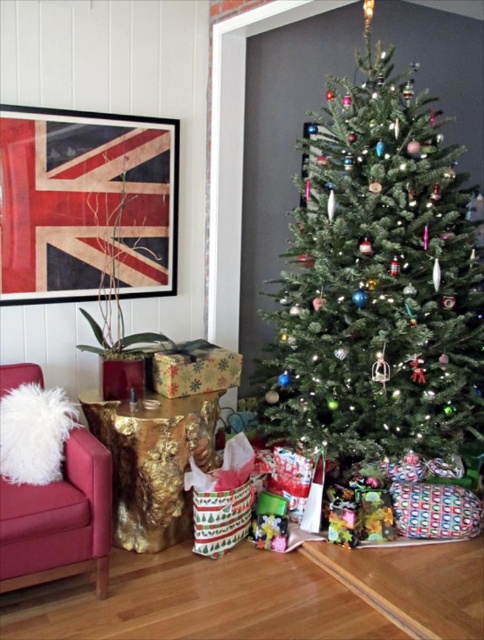
Question: Is the position of green matte christmas tree at center more distant than that of shiny gold wrapping paper at lower center?

Choices:
 (A) no
 (B) yes

Answer: (A)

Question: Which of these objects is positioned closest to the green matte christmas tree at center?

Choices:
 (A) shiny gold wrapping paper at lower center
 (B) velvet red armchair at lower left

Answer: (A)

Question: Which point is farther from the camera taking this photo?

Choices:
 (A) (374, 272)
 (B) (73, 474)

Answer: (A)

Question: Is velvet red armchair at lower left wider than shiny gold wrapping paper at lower center?

Choices:
 (A) no
 (B) yes

Answer: (B)

Question: Can you confirm if velvet red armchair at lower left is positioned above shiny gold wrapping paper at lower center?

Choices:
 (A) yes
 (B) no

Answer: (B)

Question: Which object is the farthest from the green matte christmas tree at center?

Choices:
 (A) velvet red armchair at lower left
 (B) shiny gold wrapping paper at lower center

Answer: (A)